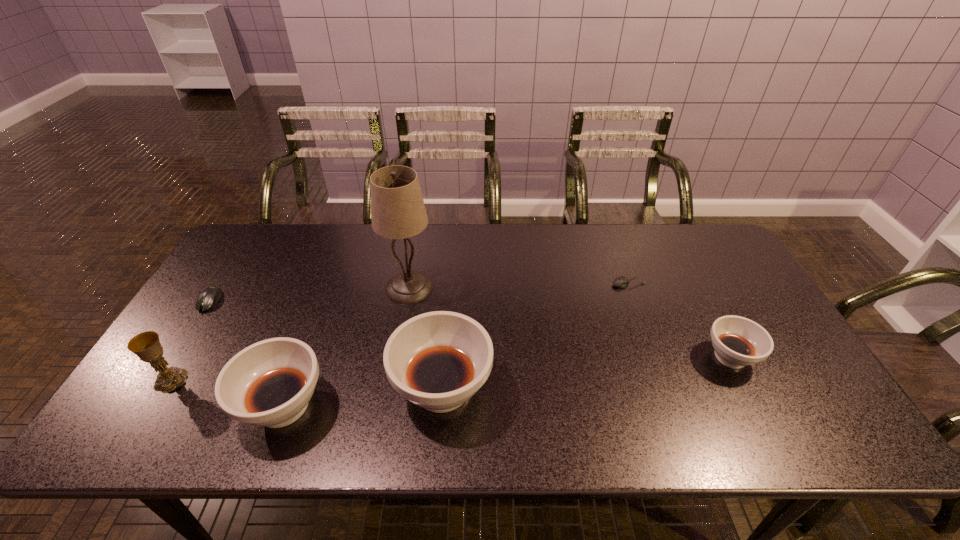
Please point a location where one more soup_bowl can be added evenly. Please provide its 2D coordinates. Your answer should be formatted as a tuple, i.e. [(x, y)], where the tuple contains the x and y coordinates of a point satisfying the conditions above.

[(590, 372)]